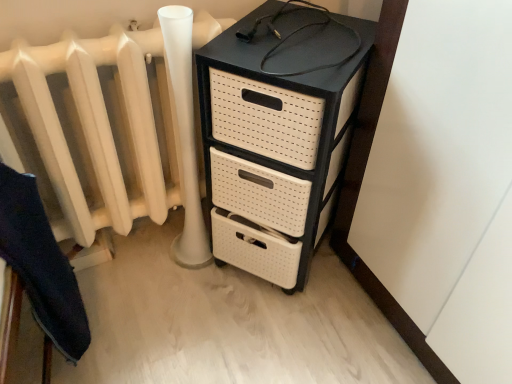
Question: From the image's perspective, is white matte radiator at left located above or below black plastic chest of drawers at upper right?

Choices:
 (A) below
 (B) above

Answer: (B)

Question: Is white matte radiator at left inside the boundaries of black plastic chest of drawers at upper right, or outside?

Choices:
 (A) outside
 (B) inside

Answer: (A)

Question: Considering the real-world distances, which object is closest to the dark blue fabric at lower left?

Choices:
 (A) white matte radiator at left
 (B) black plastic chest of drawers at upper right

Answer: (A)

Question: Based on their relative distances, which object is farther from the black plastic chest of drawers at upper right?

Choices:
 (A) white matte radiator at left
 (B) dark blue fabric at lower left

Answer: (B)